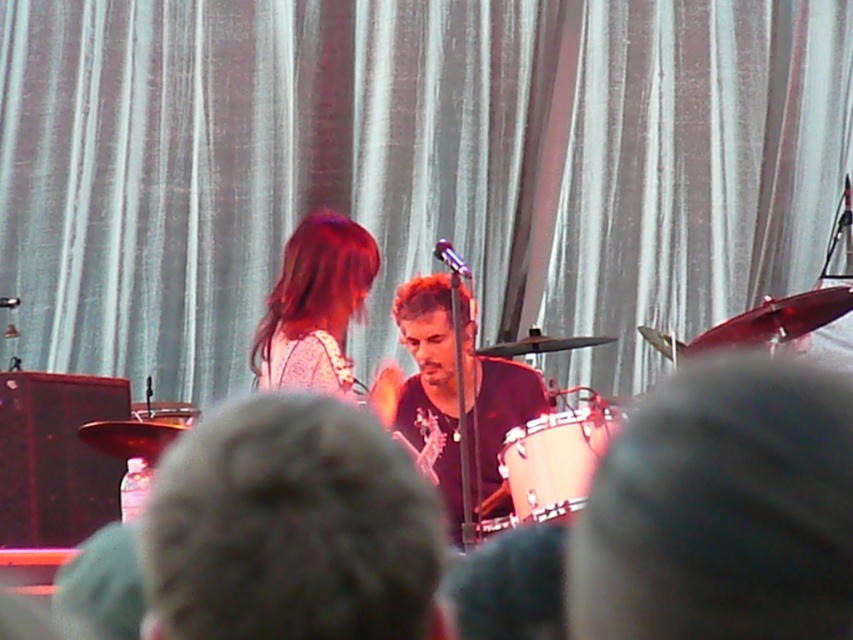
Does black matte shirt at center have a lesser width compared to matte white dress at center?

No, black matte shirt at center is not thinner than matte white dress at center.

Can you confirm if black matte shirt at center is shorter than matte white dress at center?

In fact, black matte shirt at center may be taller than matte white dress at center.

Does point (438, 362) come in front of point (322, 250)?

That is False.

What are the coordinates of `black matte shirt at center` in the screenshot? It's located at (456, 388).

Which is below, white fabric curtain at upper center or matte white dress at center?

matte white dress at center is lower down.

Who is positioned more to the right, white fabric curtain at upper center or matte white dress at center?

white fabric curtain at upper center

Is point (843, 60) less distant than point (306, 328)?

No.

Where is `white fabric curtain at upper center`? This screenshot has width=853, height=640. white fabric curtain at upper center is located at coordinates (410, 168).

Does matte white dress at center have a greater height compared to matte silver drum at center?

Indeed, matte white dress at center has a greater height compared to matte silver drum at center.

Measure the distance from matte white dress at center to matte silver drum at center.

matte white dress at center and matte silver drum at center are 22.74 inches apart.

The image size is (853, 640). What are the coordinates of `matte white dress at center` in the screenshot? It's located at (315, 305).